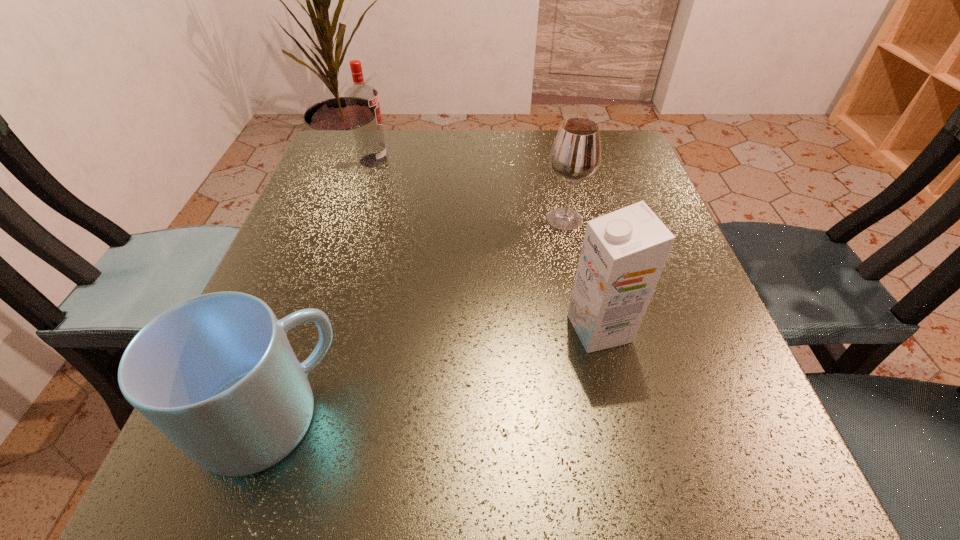
In order to click on vacant space that's between the farthest object and the wineglass in this screenshot , I will do `click(469, 190)`.

Identify the location of object that is the third closest one to the carton. (362, 101).

In order to click on object identified as the third closest to the second farthest object in this screenshot , I will do `click(216, 374)`.

Identify the location of vacant point that satisfies the following two spatial constraints: 1. on the front label of the vodka; 2. on the left side of the third nearest object. The image size is (960, 540). (355, 219).

At what (x,y) coordinates should I click in order to perform the action: click on blank space that satisfies the following two spatial constraints: 1. on the front label of the wineglass; 2. on the right side of the vodka. Please return your answer as a coordinate pair (x, y). This screenshot has width=960, height=540. Looking at the image, I should click on (355, 219).

Locate an element on the screen. vacant space that satisfies the following two spatial constraints: 1. on the front label of the farthest object; 2. on the left side of the wineglass is located at coordinates (355, 219).

You are a GUI agent. You are given a task and a screenshot of the screen. Output one action in this format:
    pyautogui.click(x=<x>, y=<y>)
    Task: Click on the free spot that satisfies the following two spatial constraints: 1. on the front label of the farthest object; 2. on the right side of the second nearest object
    Image resolution: width=960 pixels, height=540 pixels.
    Given the screenshot: What is the action you would take?
    pyautogui.click(x=321, y=328)

Identify the location of vacant region that satisfies the following two spatial constraints: 1. on the back side of the nearest object; 2. on the right side of the wineglass. (338, 219).